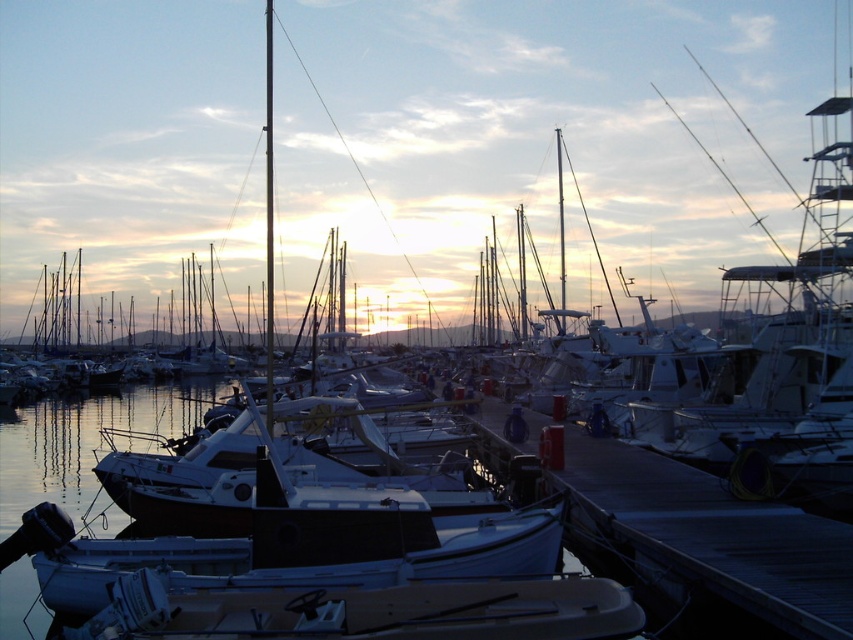
You are a dock attendant who needs to park two white matte boats. The white matte boat at lower center and the white matte boat at center are both available. Which boat requires a wider parking space?

The white matte boat at lower center requires a wider parking space because its width surpasses that of the white matte boat at center.